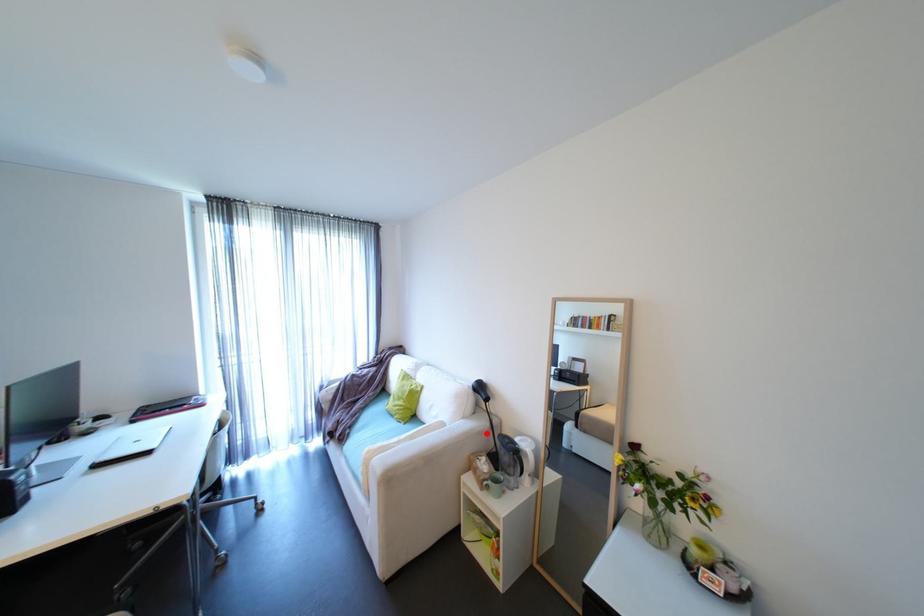
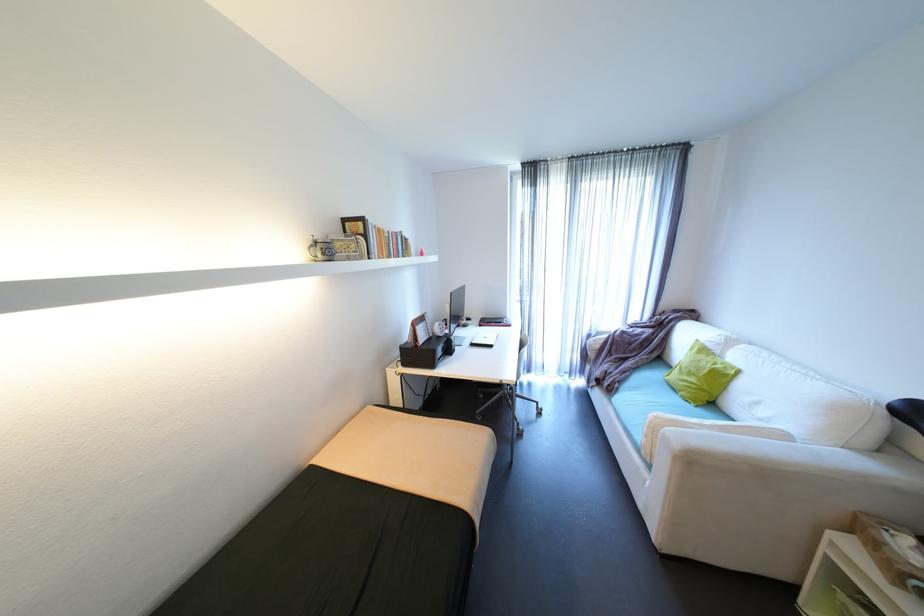
Question: I am providing you with two images of the same scene from different viewpoints. A red point is marked on the first image. Is the red point's position out of view in image 2?

Choices:
 (A) Yes
 (B) No

Answer: (B)